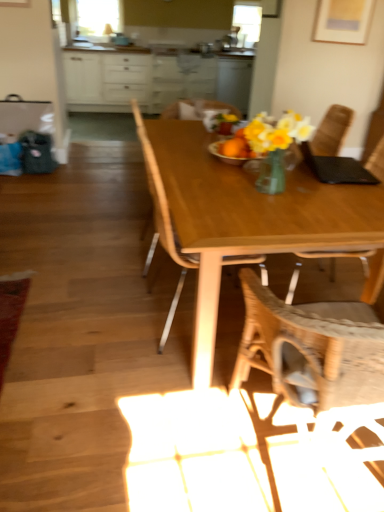
Identify the location of free space underneath woven fabric chair at center, acting as the 2th chair starting from the left (from a real-world perspective). This screenshot has width=384, height=512. (344, 464).